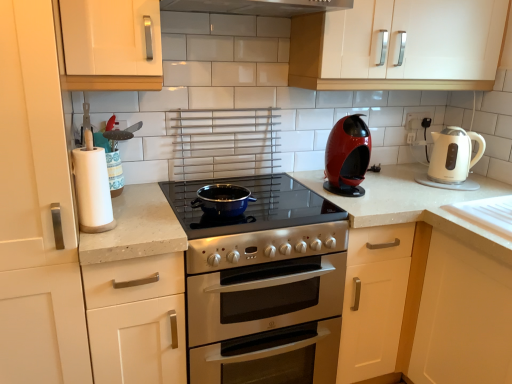
What is the approximate width of white plastic electric outlet at upper right?

white plastic electric outlet at upper right is 2.03 centimeters in width.

The width and height of the screenshot is (512, 384). Describe the element at coordinates (417, 120) in the screenshot. I see `white plastic electric outlet at upper right` at that location.

Measure the distance between white matte paper towel at left and camera.

white matte paper towel at left and camera are 3.99 feet apart from each other.

Describe the element at coordinates (137, 319) in the screenshot. This screenshot has width=512, height=384. I see `white matte cabinet at left, the third cabinetry positioned from the left` at that location.

I want to click on blue enameled wok at center, so tap(222, 200).

Locate an element on the screen. This screenshot has height=384, width=512. white glossy electric kettle at right, placed as the 1th kitchen appliance when sorted from right to left is located at coordinates (453, 155).

Considering the positions of objects red glossy coffee machine at center right, the first kitchen appliance in the left-to-right sequence, and white glossy cabinet at upper center, which ranks as the first cabinetry in right-to-left order, in the image provided, who is behind, red glossy coffee machine at center right, the first kitchen appliance in the left-to-right sequence, or white glossy cabinet at upper center, which ranks as the first cabinetry in right-to-left order,?

red glossy coffee machine at center right, the first kitchen appliance in the left-to-right sequence, is behind.

Is red glossy coffee machine at center right, the first kitchen appliance in the left-to-right sequence, in contact with white glossy cabinet at upper center, acting as the fourth cabinetry starting from the left?

No, red glossy coffee machine at center right, the first kitchen appliance in the left-to-right sequence, is not beside white glossy cabinet at upper center, acting as the fourth cabinetry starting from the left.

From the picture: From the image's perspective, is red glossy coffee machine at center right, the 2th kitchen appliance from the right, under white glossy cabinet at upper center, which ranks as the first cabinetry in right-to-left order?

Indeed, from the image's perspective, red glossy coffee machine at center right, the 2th kitchen appliance from the right, is shown beneath white glossy cabinet at upper center, which ranks as the first cabinetry in right-to-left order.

Considering the sizes of objects red glossy coffee machine at center right, the 2th kitchen appliance from the right, and white glossy cabinet at upper center, which ranks as the first cabinetry in right-to-left order, in the image provided, who is shorter, red glossy coffee machine at center right, the 2th kitchen appliance from the right, or white glossy cabinet at upper center, which ranks as the first cabinetry in right-to-left order,?

red glossy coffee machine at center right, the 2th kitchen appliance from the right.

You are a GUI agent. You are given a task and a screenshot of the screen. Output one action in this format:
    pyautogui.click(x=<x>, y=<y>)
    Task: Click on the cabinetry that is the 2nd one when counting upward from the white matte cabinet at left, positioned as the 1th cabinetry in left-to-right order (from the image's perspective)
    
    Given the screenshot: What is the action you would take?
    pyautogui.click(x=407, y=50)

Is white glossy cabinet at upper center, which ranks as the first cabinetry in right-to-left order, facing towards white matte cabinet at left, positioned as the 1th cabinetry in left-to-right order?

No, white glossy cabinet at upper center, which ranks as the first cabinetry in right-to-left order, does not turn towards white matte cabinet at left, positioned as the 1th cabinetry in left-to-right order.

Is point (475, 17) farther from camera compared to point (39, 187)?

Yes, point (475, 17) is behind point (39, 187).

Can you confirm if white glossy cabinet at upper center, which ranks as the first cabinetry in right-to-left order, is bigger than white matte cabinet at left, the 4th cabinetry positioned from the right?

Actually, white glossy cabinet at upper center, which ranks as the first cabinetry in right-to-left order, might be smaller than white matte cabinet at left, the 4th cabinetry positioned from the right.

Is white matte cabinet handle at upper left, marked as the 2th cabinetry in a left-to-right arrangement, not close to white plastic electric outlet at upper right?

Yes.

Does point (130, 41) lie behind point (429, 123)?

No, it is not.

From a real-world perspective, is white matte cabinet handle at upper left, positioned as the 3th cabinetry in right-to-left order, positioned over white plastic electric outlet at upper right based on gravity?

Correct, in the physical world, white matte cabinet handle at upper left, positioned as the 3th cabinetry in right-to-left order, is higher than white plastic electric outlet at upper right.

Considering the relative positions of white matte paper towel at left and white glossy cabinet at upper center, which ranks as the first cabinetry in right-to-left order, in the image provided, is white matte paper towel at left behind white glossy cabinet at upper center, which ranks as the first cabinetry in right-to-left order,?

No, it is not.

From the image's perspective, is white matte paper towel at left located above or below white glossy cabinet at upper center, which ranks as the first cabinetry in right-to-left order?

Clearly, from the image's perspective, white matte paper towel at left is below white glossy cabinet at upper center, which ranks as the first cabinetry in right-to-left order.

Is white matte paper towel at left aimed at white glossy cabinet at upper center, acting as the fourth cabinetry starting from the left?

No, white matte paper towel at left is not aimed at white glossy cabinet at upper center, acting as the fourth cabinetry starting from the left.

Does white matte paper towel at left appear on the left side of white glossy cabinet at upper center, acting as the fourth cabinetry starting from the left?

Yes, white matte paper towel at left is to the left of white glossy cabinet at upper center, acting as the fourth cabinetry starting from the left.

Image resolution: width=512 pixels, height=384 pixels. In order to click on wok behind the white matte paper towel at left in this screenshot , I will do `click(222, 200)`.

From the image's perspective, who appears lower, white matte paper towel at left or blue enameled wok at center?

blue enameled wok at center appears lower in the image.

Is white matte paper towel at left aimed at blue enameled wok at center?

No, white matte paper towel at left is not aimed at blue enameled wok at center.

Would you say white matte paper towel at left is inside or outside blue enameled wok at center?

white matte paper towel at left is not enclosed by blue enameled wok at center.

Are white matte cabinet handle at upper left, positioned as the 3th cabinetry in right-to-left order, and blue enameled wok at center far apart?

No, there isn't a large distance between white matte cabinet handle at upper left, positioned as the 3th cabinetry in right-to-left order, and blue enameled wok at center.

Which object is closer to the camera taking this photo, white matte cabinet handle at upper left, positioned as the 3th cabinetry in right-to-left order, or blue enameled wok at center?

white matte cabinet handle at upper left, positioned as the 3th cabinetry in right-to-left order, is closer to the camera.

In the scene shown: From the image's perspective, which object appears higher, white matte cabinet handle at upper left, positioned as the 3th cabinetry in right-to-left order, or blue enameled wok at center?

From the image's view, white matte cabinet handle at upper left, positioned as the 3th cabinetry in right-to-left order, is above.

How different are the orientations of white matte cabinet handle at upper left, marked as the 2th cabinetry in a left-to-right arrangement, and blue enameled wok at center in degrees?

The angular difference between white matte cabinet handle at upper left, marked as the 2th cabinetry in a left-to-right arrangement, and blue enameled wok at center is 0.00377 degrees.

Does white glossy electric kettle at right, placed as the 1th kitchen appliance when sorted from right to left, appear on the right side of white matte cabinet handle at upper left, marked as the 2th cabinetry in a left-to-right arrangement?

Correct, you'll find white glossy electric kettle at right, placed as the 1th kitchen appliance when sorted from right to left, to the right of white matte cabinet handle at upper left, marked as the 2th cabinetry in a left-to-right arrangement.

Are white glossy electric kettle at right, placed as the 1th kitchen appliance when sorted from right to left, and white matte cabinet handle at upper left, marked as the 2th cabinetry in a left-to-right arrangement, located far from each other?

Absolutely, white glossy electric kettle at right, placed as the 1th kitchen appliance when sorted from right to left, is distant from white matte cabinet handle at upper left, marked as the 2th cabinetry in a left-to-right arrangement.

Is white glossy electric kettle at right, placed as the 1th kitchen appliance when sorted from right to left, positioned with its back to white matte cabinet handle at upper left, marked as the 2th cabinetry in a left-to-right arrangement?

That's not correct — white glossy electric kettle at right, placed as the 1th kitchen appliance when sorted from right to left, is not looking away from white matte cabinet handle at upper left, marked as the 2th cabinetry in a left-to-right arrangement.

The height and width of the screenshot is (384, 512). Identify the location of the 1st kitchen appliance below the white glossy cabinet at upper center, which ranks as the first cabinetry in right-to-left order (from the image's perspective). (347, 156).

From the image's perspective, which cabinetry is the 2nd one above the white matte cabinet at left, the 4th cabinetry positioned from the right? Please provide its 2D coordinates.

[(407, 50)]

From the picture: When comparing their distances from red glossy coffee machine at center right, the 2th kitchen appliance from the right, does white plastic electric outlet at upper right or white matte cabinet handle at upper left, marked as the 2th cabinetry in a left-to-right arrangement, seem further?

white matte cabinet handle at upper left, marked as the 2th cabinetry in a left-to-right arrangement.

Looking at the image, which one is located further to white matte cabinet handle at upper left, marked as the 2th cabinetry in a left-to-right arrangement, white matte paper towel at left or white glossy electric kettle at right, placed as the 1th kitchen appliance when sorted from right to left?

white glossy electric kettle at right, placed as the 1th kitchen appliance when sorted from right to left, is positioned further to the anchor white matte cabinet handle at upper left, marked as the 2th cabinetry in a left-to-right arrangement.

Consider the image. Based on their spatial positions, is blue enameled wok at center or white plastic electric outlet at upper right further from white glossy cabinet at upper center, acting as the fourth cabinetry starting from the left?

blue enameled wok at center is further to white glossy cabinet at upper center, acting as the fourth cabinetry starting from the left.

Based on their spatial positions, is white plastic electric outlet at upper right or red glossy coffee machine at center right, the first kitchen appliance in the left-to-right sequence, closer to white glossy cabinet at upper center, acting as the fourth cabinetry starting from the left?

red glossy coffee machine at center right, the first kitchen appliance in the left-to-right sequence.

When comparing their distances from white matte cabinet handle at upper left, marked as the 2th cabinetry in a left-to-right arrangement, does white matte cabinet at left, the 2th cabinetry positioned from the right, or white matte paper towel at left seem further?

Based on the image, white matte cabinet at left, the 2th cabinetry positioned from the right, appears to be further to white matte cabinet handle at upper left, marked as the 2th cabinetry in a left-to-right arrangement.

Looking at this image, which object lies nearer to the anchor point red glossy coffee machine at center right, the first kitchen appliance in the left-to-right sequence, white matte cabinet handle at upper left, marked as the 2th cabinetry in a left-to-right arrangement, or white glossy cabinet at upper center, which ranks as the first cabinetry in right-to-left order?

white glossy cabinet at upper center, which ranks as the first cabinetry in right-to-left order, is positioned closer to the anchor red glossy coffee machine at center right, the first kitchen appliance in the left-to-right sequence.

Based on their spatial positions, is white matte paper towel at left or red glossy coffee machine at center right, the 2th kitchen appliance from the right, further from white glossy cabinet at upper center, acting as the fourth cabinetry starting from the left?

white matte paper towel at left.

Based on their spatial positions, is white matte cabinet at left, the 2th cabinetry positioned from the right, or white glossy cabinet at upper center, acting as the fourth cabinetry starting from the left, further from red glossy coffee machine at center right, the 2th kitchen appliance from the right?

white matte cabinet at left, the 2th cabinetry positioned from the right, is further to red glossy coffee machine at center right, the 2th kitchen appliance from the right.

The height and width of the screenshot is (384, 512). What are the coordinates of `wok that lies between white matte cabinet handle at upper left, marked as the 2th cabinetry in a left-to-right arrangement, and white matte cabinet at left, the 4th cabinetry positioned from the right, from top to bottom` in the screenshot? It's located at (222, 200).

Identify the location of paper towel between white matte cabinet at left, positioned as the 1th cabinetry in left-to-right order, and white glossy electric kettle at right, placed as the 1th kitchen appliance when sorted from right to left, from left to right. (92, 189).

Find the location of `cabinetry between white matte cabinet at left, the 2th cabinetry positioned from the right, and white plastic electric outlet at upper right, in the horizontal direction`. cabinetry between white matte cabinet at left, the 2th cabinetry positioned from the right, and white plastic electric outlet at upper right, in the horizontal direction is located at coordinates (407, 50).

Find the location of a particular element. wok between white matte cabinet handle at upper left, marked as the 2th cabinetry in a left-to-right arrangement, and white matte cabinet at left, the 2th cabinetry positioned from the right, from top to bottom is located at coordinates (222, 200).